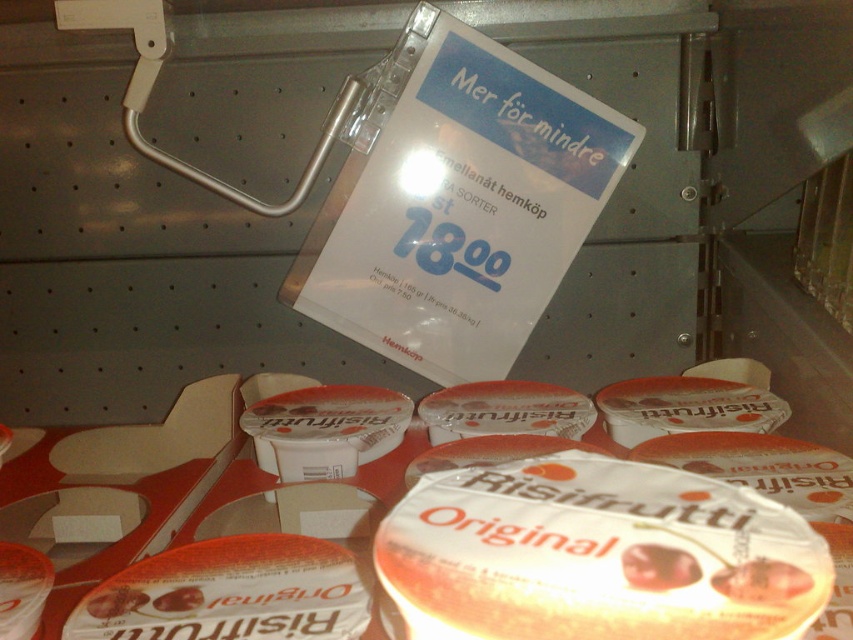
Is point (352, 211) behind point (323, 586)?

Yes, point (352, 211) is farther from viewer.

Does point (532, 285) lie behind point (287, 598)?

Yes, point (532, 285) is behind point (287, 598).

At what (x,y) coordinates should I click in order to perform the action: click on white plastic sign at upper center. Please return your answer as a coordinate pair (x, y). The height and width of the screenshot is (640, 853). Looking at the image, I should click on (457, 204).

Between point (769, 529) and point (123, 637), which one is positioned behind?

The point (123, 637) is behind.

Can you confirm if translucent plastic cup at center is positioned to the left of white matte risifrutti original at center?

Incorrect, translucent plastic cup at center is not on the left side of white matte risifrutti original at center.

Locate an element on the screen. The width and height of the screenshot is (853, 640). translucent plastic cup at center is located at coordinates (596, 554).

I want to click on translucent plastic cup at center, so click(596, 554).

Who is more forward, [451,70] or [705,595]?

Point [705,595] is in front.

Image resolution: width=853 pixels, height=640 pixels. In order to click on white plastic sign at upper center in this screenshot , I will do `click(457, 204)`.